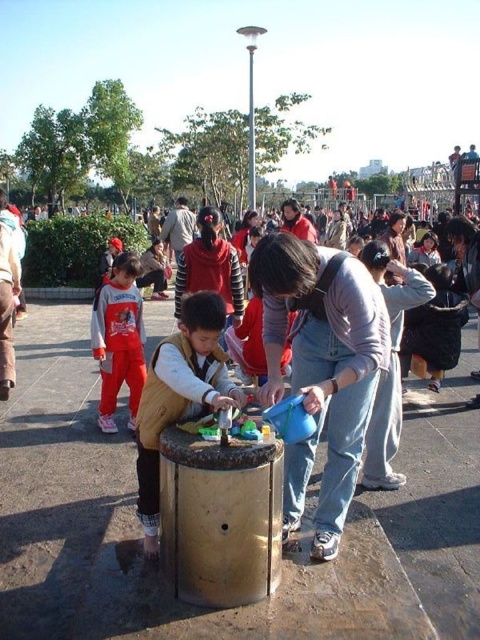
Which is more to the left, matte red pants at center or matte black jacket at center?

Positioned to the left is matte red pants at center.

Is matte red pants at center to the left of matte black jacket at center from the viewer's perspective?

Yes, matte red pants at center is to the left of matte black jacket at center.

Is point (130, 360) closer to camera compared to point (180, 301)?

That is True.

You are a GUI agent. You are given a task and a screenshot of the screen. Output one action in this format:
    pyautogui.click(x=<x>, y=<y>)
    Task: Click on the matte red pants at center
    This screenshot has height=640, width=480.
    Given the screenshot: What is the action you would take?
    pyautogui.click(x=119, y=339)

Is point (182, 362) farther from viewer compared to point (126, 308)?

That is False.

This screenshot has height=640, width=480. Describe the element at coordinates (180, 396) in the screenshot. I see `light brown vest at center` at that location.

Who is more forward, (183,387) or (104,316)?

Point (183,387) is in front.

I want to click on light brown vest at center, so click(x=180, y=396).

Based on the photo, does light brown vest at center appear on the right side of matte black jacket at center?

In fact, light brown vest at center is to the left of matte black jacket at center.

Is light brown vest at center bigger than matte black jacket at center?

Indeed, light brown vest at center has a larger size compared to matte black jacket at center.

Does point (217, 369) come behind point (207, 248)?

No, (217, 369) is closer to viewer.

Image resolution: width=480 pixels, height=640 pixels. What are the coordinates of `light brown vest at center` in the screenshot? It's located at (180, 396).